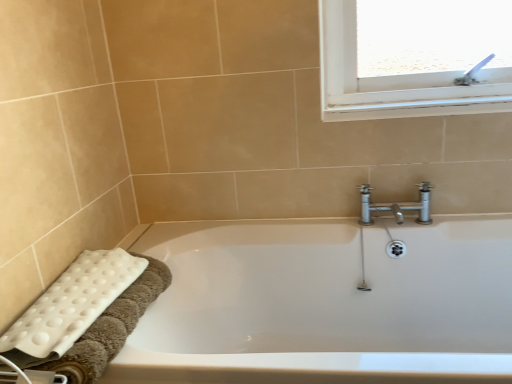
Question: From the image's perspective, does white plastic towel bar at lower left appear higher than white textured bath towel at lower left?

Choices:
 (A) no
 (B) yes

Answer: (A)

Question: Is white plastic towel bar at lower left positioned far away from white textured bath towel at lower left?

Choices:
 (A) yes
 (B) no

Answer: (B)

Question: Can you confirm if white plastic towel bar at lower left is thinner than white textured bath towel at lower left?

Choices:
 (A) yes
 (B) no

Answer: (A)

Question: Is white plastic towel bar at lower left behind white textured bath towel at lower left?

Choices:
 (A) yes
 (B) no

Answer: (B)

Question: From a real-world perspective, is white plastic towel bar at lower left beneath white textured bath towel at lower left?

Choices:
 (A) no
 (B) yes

Answer: (B)

Question: Considering their positions, is white textured bath towel at lower left located in front of or behind white plastic towel bar at lower left?

Choices:
 (A) behind
 (B) front

Answer: (A)

Question: Considering the positions of white textured bath towel at lower left and white plastic towel bar at lower left in the image, is white textured bath towel at lower left wider or thinner than white plastic towel bar at lower left?

Choices:
 (A) thin
 (B) wide

Answer: (B)

Question: Is white textured bath towel at lower left inside or outside of white plastic towel bar at lower left?

Choices:
 (A) outside
 (B) inside

Answer: (A)

Question: Considering the relative positions of white textured bath towel at lower left and white plastic towel bar at lower left in the image provided, is white textured bath towel at lower left to the left or to the right of white plastic towel bar at lower left?

Choices:
 (A) left
 (B) right

Answer: (A)

Question: From the image's perspective, is white textured bath towel at lower left positioned above or below white glossy bathtub at lower left?

Choices:
 (A) above
 (B) below

Answer: (A)

Question: In the image, is white textured bath towel at lower left positioned in front of or behind white glossy bathtub at lower left?

Choices:
 (A) behind
 (B) front

Answer: (A)

Question: From their relative heights in the image, would you say white textured bath towel at lower left is taller or shorter than white glossy bathtub at lower left?

Choices:
 (A) tall
 (B) short

Answer: (B)

Question: Considering the relative positions of white textured bath towel at lower left and white glossy bathtub at lower left in the image provided, is white textured bath towel at lower left to the left or to the right of white glossy bathtub at lower left?

Choices:
 (A) right
 (B) left

Answer: (B)

Question: Is white plastic towel bar at lower left taller or shorter than white glossy bathtub at lower left?

Choices:
 (A) short
 (B) tall

Answer: (A)

Question: Considering their positions, is white plastic towel bar at lower left located in front of or behind white glossy bathtub at lower left?

Choices:
 (A) behind
 (B) front

Answer: (B)